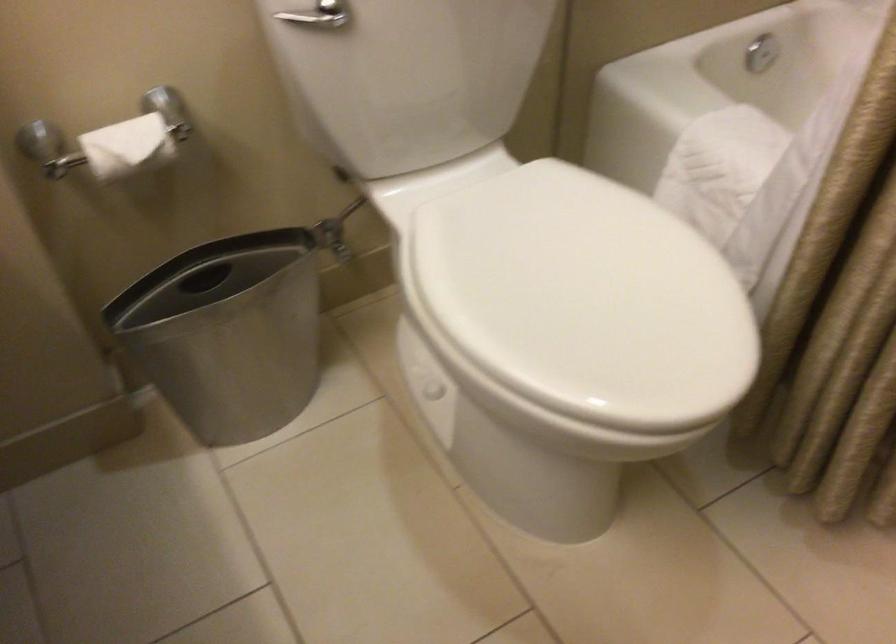
Image resolution: width=896 pixels, height=644 pixels. Find the location of `silver toilet lever`. silver toilet lever is located at coordinates (305, 17).